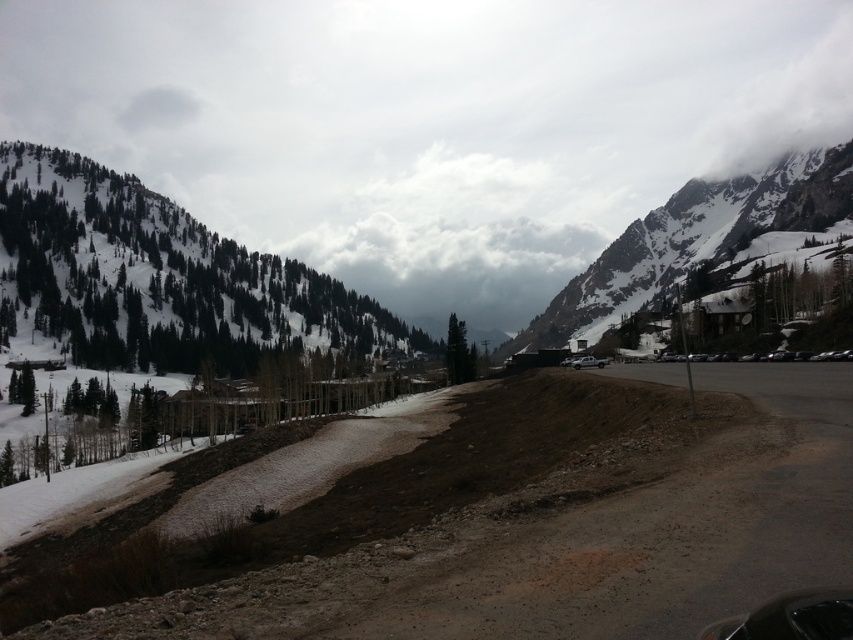
Question: Does brown dirt track at center have a smaller size compared to snowy evergreen forest at upper left?

Choices:
 (A) no
 (B) yes

Answer: (B)

Question: Is snowy evergreen forest at upper left above snowy granite mountain at upper right?

Choices:
 (A) no
 (B) yes

Answer: (A)

Question: Which of the following is the farthest from the observer?

Choices:
 (A) (708, 204)
 (B) (683, 476)
 (C) (373, 339)

Answer: (A)

Question: Among these objects, which one is nearest to the camera?

Choices:
 (A) snowy granite mountain at upper right
 (B) snowy evergreen forest at upper left

Answer: (B)

Question: Which of the following is the farthest from the observer?

Choices:
 (A) snowy granite mountain at upper right
 (B) snowy evergreen forest at upper left
 (C) brown dirt track at center

Answer: (A)

Question: Does brown dirt track at center appear over snowy evergreen forest at upper left?

Choices:
 (A) yes
 (B) no

Answer: (B)